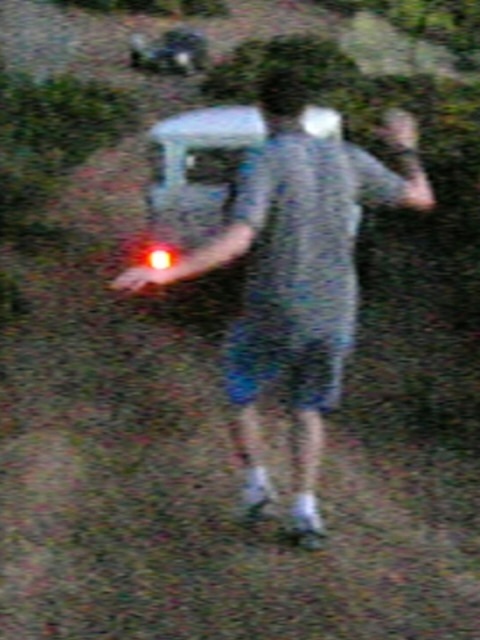
Between matte gray shirt at center and white plastic car at center, which one is positioned higher?

white plastic car at center is above.

Is the position of matte gray shirt at center more distant than that of white plastic car at center?

No, it is not.

Is point (314, 141) positioned in front of point (213, 204)?

Yes, point (314, 141) is in front of point (213, 204).

You are a GUI agent. You are given a task and a screenshot of the screen. Output one action in this format:
    pyautogui.click(x=<x>, y=<y>)
    Task: Click on the matte gray shirt at center
    
    Given the screenshot: What is the action you would take?
    pyautogui.click(x=296, y=275)